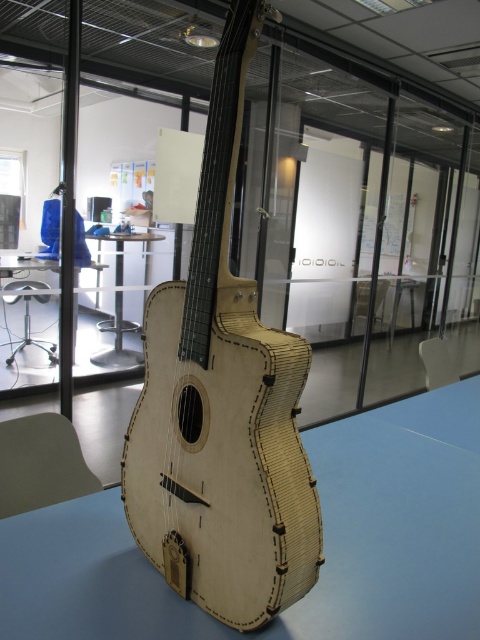
You are an office worker who needs to place a heavy box on the wooden table at center. The natural wood guitar at center is currently on the table. Can you put the box on the table without moving the guitar?

The natural wood guitar at center is above wooden table at center, meaning it is already placed on the table. To place the box without moving the guitar, you would need to position it around or beside the guitar on the table.

You are standing in front of the guitar on the light blue table. You notice two points marked on the guitar. One is at point [130,579] and the other is at point [118,272]. Which point is closer to you?

Point [130,579] is closer to the viewer than point [118,272].

You are a delivery person placing a package on the light wood table at center. The package requires a minimum of 20 inches of space to fit. Can the natural wood guitar at center be moved to accommodate the package?

The distance between the natural wood guitar at center and the light wood table at center is 19.37 inches. Since the required space is 20 inches, the package cannot fit without moving the guitar further away or finding a larger table.